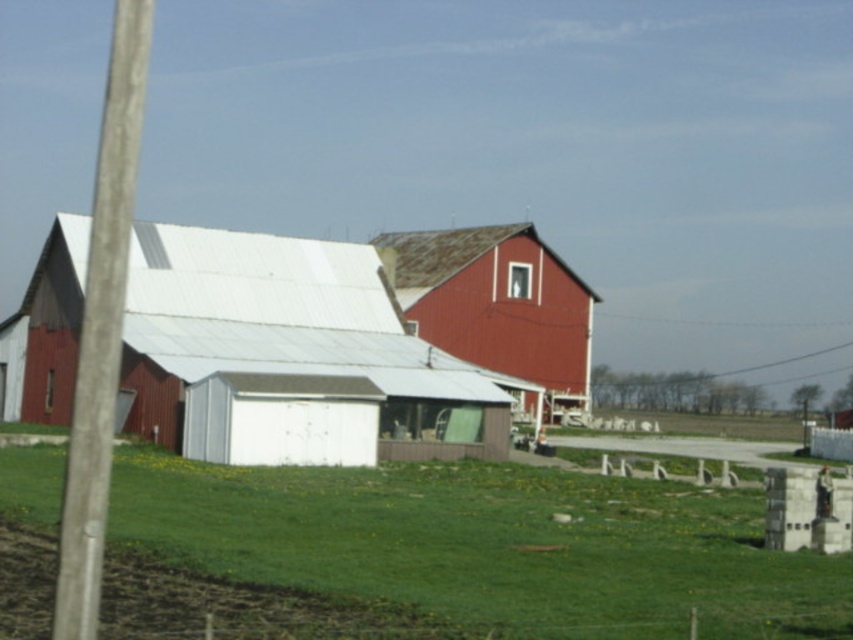
Question: Is the position of smooth red barn at center more distant than that of smooth gray pole at left?

Choices:
 (A) no
 (B) yes

Answer: (B)

Question: Is smooth red barn at center wider than smooth gray pole at left?

Choices:
 (A) yes
 (B) no

Answer: (B)

Question: Which object is positioned farthest from the green grassy field at lower center?

Choices:
 (A) smooth red barn at center
 (B) smooth gray pole at left

Answer: (A)

Question: Does matte white barn at center have a smaller size compared to smooth gray pole at left?

Choices:
 (A) no
 (B) yes

Answer: (B)

Question: Which object appears closest to the camera in this image?

Choices:
 (A) smooth red barn at center
 (B) matte white barn at center

Answer: (B)

Question: Which is farther from the smooth red barn at center?

Choices:
 (A) matte white barn at center
 (B) green grassy field at lower center

Answer: (B)